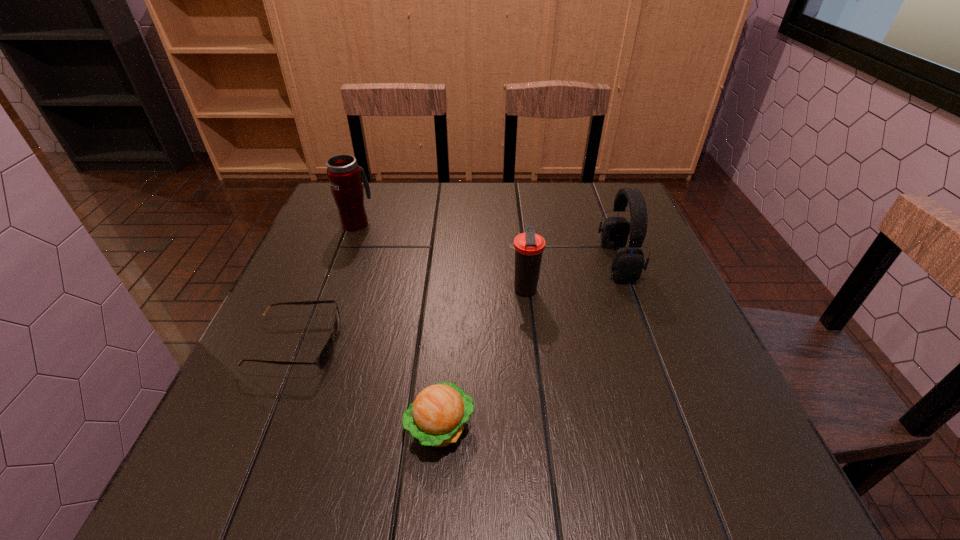
The width and height of the screenshot is (960, 540). I want to click on free spot between the headset and the nearer thermos bottle, so click(571, 276).

Locate an element on the screen. blank region between the fourth farthest object and the farthest object is located at coordinates (326, 284).

You are a GUI agent. You are given a task and a screenshot of the screen. Output one action in this format:
    pyautogui.click(x=<x>, y=<y>)
    Task: Click on the vacant space that is in between the third object from right to left and the nearer thermos bottle
    The width and height of the screenshot is (960, 540).
    Given the screenshot: What is the action you would take?
    pyautogui.click(x=482, y=358)

I want to click on free area in between the farthest object and the rightmost object, so click(488, 242).

The image size is (960, 540). I want to click on vacant region between the third object from left to right and the nearer thermos bottle, so coord(482,358).

Locate an element on the screen. Image resolution: width=960 pixels, height=540 pixels. empty space between the hamburger and the nearer thermos bottle is located at coordinates (482, 358).

Where is `free spot between the second object from right to left and the shortest object`? free spot between the second object from right to left and the shortest object is located at coordinates (410, 318).

This screenshot has width=960, height=540. What are the coordinates of `free spot between the rightmost object and the farther thermos bottle` in the screenshot? It's located at (488, 242).

Locate an element on the screen. The height and width of the screenshot is (540, 960). vacant space in between the nearest object and the second nearest object is located at coordinates (368, 386).

Image resolution: width=960 pixels, height=540 pixels. What are the coordinates of `object that is the second closest to the second object from right to left` in the screenshot? It's located at (437, 417).